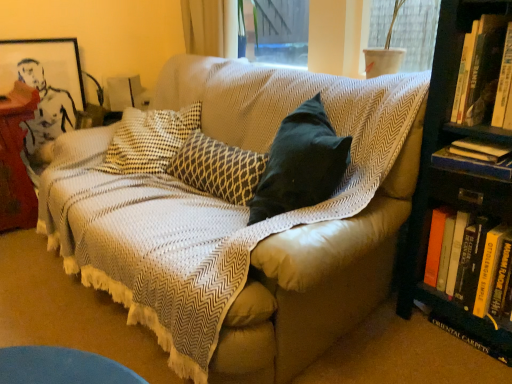
What do you see at coordinates (406, 30) in the screenshot? This screenshot has height=384, width=512. I see `white plastic pot at upper right` at bounding box center [406, 30].

Measure the distance between hardcover book at right, arranged as the first book when ordered from the bottom, and camera.

1.18 meters.

I want to click on gold-patterned fabric pillow at center, so click(x=218, y=168).

The height and width of the screenshot is (384, 512). What do you see at coordinates (479, 150) in the screenshot? I see `hardcover book at right, the third book ordered from the bottom` at bounding box center [479, 150].

What do you see at coordinates (239, 222) in the screenshot? Image resolution: width=512 pixels, height=384 pixels. I see `textured beige couch at center` at bounding box center [239, 222].

Identify the location of white plastic pot at upper right. This screenshot has height=384, width=512. (406, 30).

From the image's perspective, is gold-patterned fabric pillow at center over matte black picture frame at upper left?

Incorrect, from the image's perspective, gold-patterned fabric pillow at center is lower than matte black picture frame at upper left.

Is gold-patterned fabric pillow at center taller or shorter than matte black picture frame at upper left?

In the image, gold-patterned fabric pillow at center appears to be shorter than matte black picture frame at upper left.

Between gold-patterned fabric pillow at center and matte black picture frame at upper left, which one has smaller size?

With smaller size is matte black picture frame at upper left.

Does point (254, 155) come closer to viewer compared to point (3, 51)?

Yes.

Is point (475, 148) positioned after point (448, 157)?

That is False.

From the image's perspective, relative to hardcover book at right, which is the 3th book from top to bottom, is hardcover book at right, the second book when ordered from top to bottom, above or below?

hardcover book at right, the second book when ordered from top to bottom, is situated higher than hardcover book at right, which is the 3th book from top to bottom, in the image.

Are hardcover book at right, the second book when ordered from top to bottom, and hardcover book at right, which ranks as the second book in bottom-to-top order, beside each other?

Yes, hardcover book at right, the second book when ordered from top to bottom, is in contact with hardcover book at right, which ranks as the second book in bottom-to-top order.

Does hardcover book at right, the third book ordered from the bottom, come in front of hardcover book at right, which ranks as the second book in bottom-to-top order?

No, it is not.

Is point (42, 40) behind point (374, 33)?

That is True.

This screenshot has width=512, height=384. I want to click on picture frame located behind the white plastic pot at upper right, so click(45, 65).

Between matte black picture frame at upper left and white plastic pot at upper right, which one has smaller size?

matte black picture frame at upper left is smaller.

Considering the positions of points (465, 249) and (479, 153), is point (465, 249) farther from camera compared to point (479, 153)?

Yes.

Which of these two, hardcover book at right, the fourth book viewed from the top, or hardcover book at right, the third book ordered from the bottom, is bigger?

Bigger between the two is hardcover book at right, the fourth book viewed from the top.

Image resolution: width=512 pixels, height=384 pixels. There is a hardcover book at right, arranged as the first book when ordered from the bottom. In order to click on the 2nd book above it (from the image's perspective) in this screenshot , I will do `click(479, 150)`.

From the image's perspective, who appears lower, hardcover book at right, which is the 3th book from top to bottom, or matte black picture frame at upper left?

hardcover book at right, which is the 3th book from top to bottom, appears lower in the image.

Measure the distance from hardcover book at right, which ranks as the second book in bottom-to-top order, to matte black picture frame at upper left.

They are 7.40 feet apart.

Which of these two, hardcover book at right, which is the 3th book from top to bottom, or matte black picture frame at upper left, is smaller?

hardcover book at right, which is the 3th book from top to bottom, is smaller.

Does hardcover book at right, which ranks as the second book in bottom-to-top order, have a lesser width compared to matte black picture frame at upper left?

Incorrect, the width of hardcover book at right, which ranks as the second book in bottom-to-top order, is not less than that of matte black picture frame at upper left.

In the scene shown: Does textured beige couch at center contain hardcover book at right, arranged as the first book when ordered from the bottom?

No, hardcover book at right, arranged as the first book when ordered from the bottom, is not a part of textured beige couch at center.

Could you measure the distance between textured beige couch at center and hardcover book at right, arranged as the first book when ordered from the bottom?

textured beige couch at center is 26.28 inches away from hardcover book at right, arranged as the first book when ordered from the bottom.

Considering the relative positions of textured beige couch at center and hardcover book at right, arranged as the first book when ordered from the bottom, in the image provided, is textured beige couch at center to the right of hardcover book at right, arranged as the first book when ordered from the bottom, from the viewer's perspective?

In fact, textured beige couch at center is to the left of hardcover book at right, arranged as the first book when ordered from the bottom.

From their relative heights in the image, would you say textured beige couch at center is taller or shorter than hardcover book at right, arranged as the first book when ordered from the bottom?

textured beige couch at center is shorter than hardcover book at right, arranged as the first book when ordered from the bottom.

Is white plastic pot at upper right aimed at matte black picture frame at upper left?

No, white plastic pot at upper right is not turned towards matte black picture frame at upper left.

From a real-world perspective, which object stands above the other?

In real-world perspective, white plastic pot at upper right is above.

Identify the location of window screen located above the matte black picture frame at upper left (from a real-world perspective). (406, 30).

How distant is white plastic pot at upper right from matte black picture frame at upper left?

white plastic pot at upper right and matte black picture frame at upper left are 6.13 feet apart.

You are a GUI agent. You are given a task and a screenshot of the screen. Output one action in this format:
    pyautogui.click(x=<x>, y=<y>)
    Task: Click on the picture frame located above the gold-patterned fabric pillow at center (from the image's perspective)
    The height and width of the screenshot is (384, 512).
    Given the screenshot: What is the action you would take?
    pyautogui.click(x=45, y=65)

Locate an element on the screen. book behind the hardcover book at right, which is the 3th book from top to bottom is located at coordinates (479, 150).

From the image, which object appears to be nearer to hardcover book at right, the second book when ordered from top to bottom, gold-patterned fabric pillow at center or matte black picture frame at upper left?

gold-patterned fabric pillow at center lies closer to hardcover book at right, the second book when ordered from top to bottom, than the other object.

Estimate the real-world distances between objects in this image. Which object is further from textured beige couch at center, hardcover book at right, arranged as the first book when ordered from the bottom, or hardcover book at right, which is the 3th book from top to bottom?

Based on the image, hardcover book at right, which is the 3th book from top to bottom, appears to be further to textured beige couch at center.

When comparing their distances from hardcover book at right, which ranks as the second book in bottom-to-top order, does white plastic pot at upper right or hardcover book at right, which ranks as the fourth book in bottom-to-top order, seem closer?

hardcover book at right, which ranks as the fourth book in bottom-to-top order.

Estimate the real-world distances between objects in this image. Which object is closer to white plastic pot at upper right, textured beige couch at center or matte black picture frame at upper left?

textured beige couch at center lies closer to white plastic pot at upper right than the other object.

Considering their positions, is hardcover book at right, which ranks as the second book in bottom-to-top order, positioned further to hardcover book at right, which ranks as the fourth book in bottom-to-top order, than hardcover book at right, arranged as the first book when ordered from the bottom?

hardcover book at right, arranged as the first book when ordered from the bottom, is further to hardcover book at right, which ranks as the fourth book in bottom-to-top order.

From the image, which object appears to be farther from hardcover book at right, placed as the first book when sorted from top to bottom, gold-patterned fabric pillow at center or hardcover book at right, the third book ordered from the bottom?

gold-patterned fabric pillow at center lies further to hardcover book at right, placed as the first book when sorted from top to bottom, than the other object.

Which object lies further to the anchor point white plastic pot at upper right, hardcover book at right, the third book ordered from the bottom, or hardcover book at right, arranged as the first book when ordered from the bottom?

hardcover book at right, arranged as the first book when ordered from the bottom.

Which object lies nearer to the anchor point hardcover book at right, the second book when ordered from top to bottom, white plastic pot at upper right or gold-patterned fabric pillow at center?

white plastic pot at upper right is positioned closer to the anchor hardcover book at right, the second book when ordered from top to bottom.

Where is `window screen situated between gold-patterned fabric pillow at center and hardcover book at right, which ranks as the second book in bottom-to-top order, from left to right`? This screenshot has height=384, width=512. window screen situated between gold-patterned fabric pillow at center and hardcover book at right, which ranks as the second book in bottom-to-top order, from left to right is located at coordinates (406, 30).

This screenshot has height=384, width=512. What are the coordinates of `book between hardcover book at right, placed as the first book when sorted from top to bottom, and hardcover book at right, which is the 3th book from top to bottom, in the vertical direction` in the screenshot? It's located at click(479, 150).

Find the location of a particular element. studio couch located between gold-patterned fabric pillow at center and hardcover book at right, placed as the first book when sorted from top to bottom, in the left-right direction is located at coordinates (239, 222).

I want to click on window screen situated between matte black picture frame at upper left and hardcover book at right, which ranks as the fourth book in bottom-to-top order, from left to right, so click(x=406, y=30).